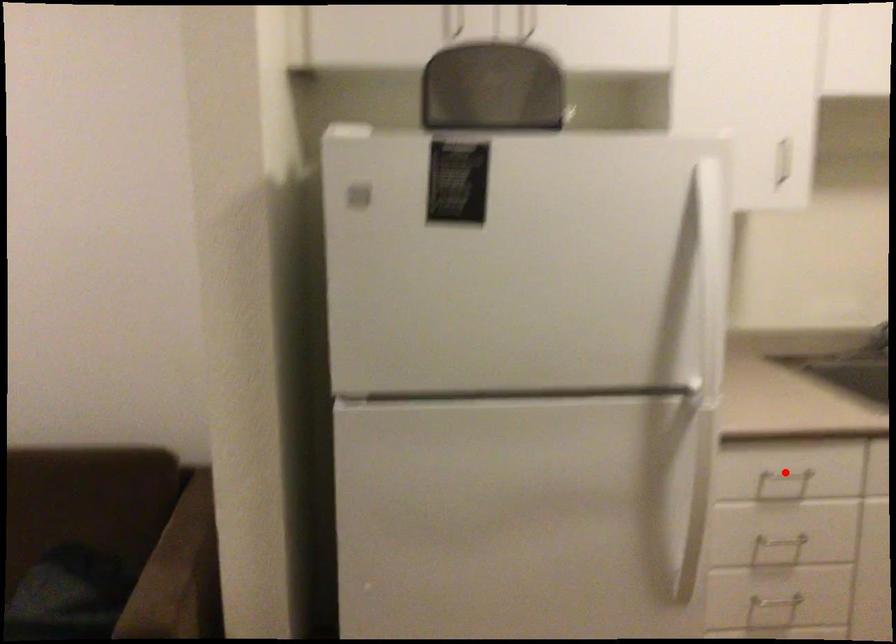
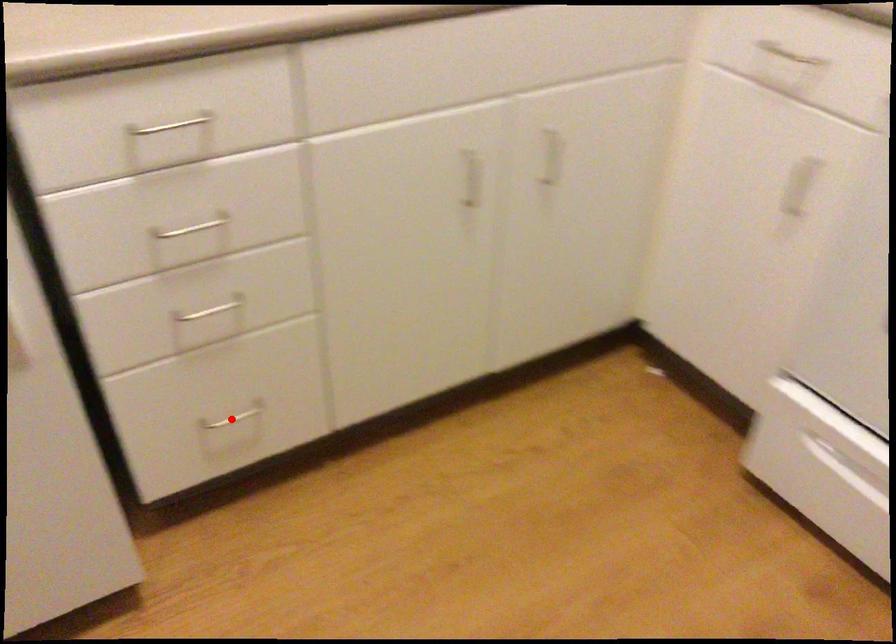
I am providing you with two images of the same scene from different viewpoints. A red point is marked on the first image and another point is marked on the second image. Is the marked point in image1 the same physical position as the marked point in image2?

No